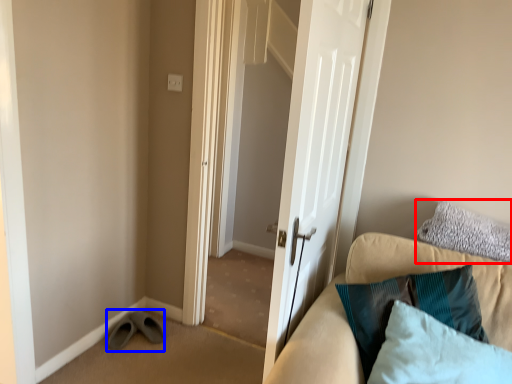
Question: Which object appears farthest to the camera in this image, pillow (highlighted by a red box) or shoe (highlighted by a blue box)?

Choices:
 (A) pillow
 (B) shoe

Answer: (B)